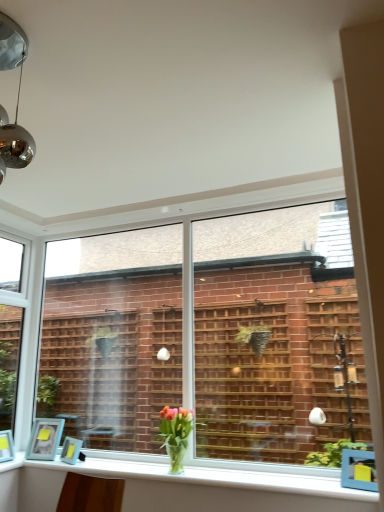
Question: Is matte blue picture frame at lower left, positioned as the second picture frame in right-to-left order, positioned behind clear glass window at left, which is the 1th window from left to right?

Choices:
 (A) no
 (B) yes

Answer: (B)

Question: From a real-world perspective, is matte blue picture frame at lower left, positioned as the second picture frame in right-to-left order, positioned under clear glass window at left, which appears as the 2th window when viewed from the right, based on gravity?

Choices:
 (A) no
 (B) yes

Answer: (B)

Question: Can you confirm if matte blue picture frame at lower left, positioned as the second picture frame in right-to-left order, is positioned to the right of clear glass window at left, which appears as the 2th window when viewed from the right?

Choices:
 (A) no
 (B) yes

Answer: (B)

Question: Is matte blue picture frame at lower left, positioned as the second picture frame in right-to-left order, beside clear glass window at left, which appears as the 2th window when viewed from the right?

Choices:
 (A) yes
 (B) no

Answer: (B)

Question: Does matte blue picture frame at lower left, which is the 1th picture frame in left-to-right order, have a lesser width compared to clear glass window at left, which appears as the 2th window when viewed from the right?

Choices:
 (A) yes
 (B) no

Answer: (B)

Question: In terms of size, does white glossy window sill at lower center appear bigger or smaller than matte blue picture frame at lower left, which is the 1th picture frame in left-to-right order?

Choices:
 (A) small
 (B) big

Answer: (B)

Question: From a real-world perspective, is white glossy window sill at lower center above or below matte blue picture frame at lower left, which is the 1th picture frame in left-to-right order?

Choices:
 (A) above
 (B) below

Answer: (B)

Question: From the image's perspective, is white glossy window sill at lower center located above or below matte blue picture frame at lower left, positioned as the second picture frame in right-to-left order?

Choices:
 (A) below
 (B) above

Answer: (A)

Question: Looking at their shapes, would you say white glossy window sill at lower center is wider or thinner than matte blue picture frame at lower left, positioned as the second picture frame in right-to-left order?

Choices:
 (A) wide
 (B) thin

Answer: (A)

Question: Relative to matte blue picture frame at lower left, which is the 1th picture frame in left-to-right order, is translucent glass vase at lower center in front or behind?

Choices:
 (A) front
 (B) behind

Answer: (A)

Question: From a real-world perspective, is translucent glass vase at lower center positioned above or below matte blue picture frame at lower left, which is the 1th picture frame in left-to-right order?

Choices:
 (A) below
 (B) above

Answer: (B)

Question: Is point (185, 409) positioned closer to the camera than point (49, 420)?

Choices:
 (A) farther
 (B) closer

Answer: (B)

Question: Looking at their shapes, would you say translucent glass vase at lower center is wider or thinner than matte blue picture frame at lower left, positioned as the second picture frame in right-to-left order?

Choices:
 (A) wide
 (B) thin

Answer: (A)

Question: In terms of height, does matte blue picture frame at lower left, positioned as the second picture frame in right-to-left order, look taller or shorter compared to matte blue picture frame at lower left, the 2th picture frame when ordered from left to right?

Choices:
 (A) short
 (B) tall

Answer: (B)

Question: Is matte blue picture frame at lower left, which is the 1th picture frame in left-to-right order, in front of or behind matte blue picture frame at lower left, the 2th picture frame when ordered from left to right, in the image?

Choices:
 (A) front
 (B) behind

Answer: (B)